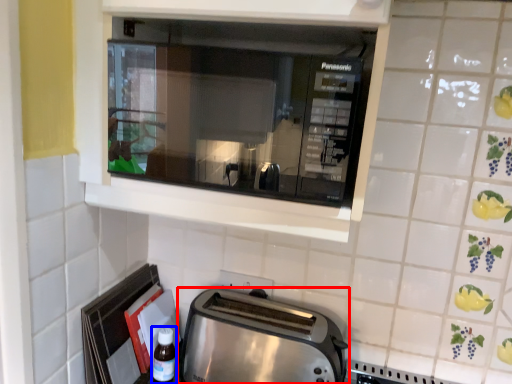
Question: Which point is closer to the camera, toaster (highlighted by a red box) or bottle (highlighted by a blue box)?

Choices:
 (A) toaster
 (B) bottle

Answer: (A)